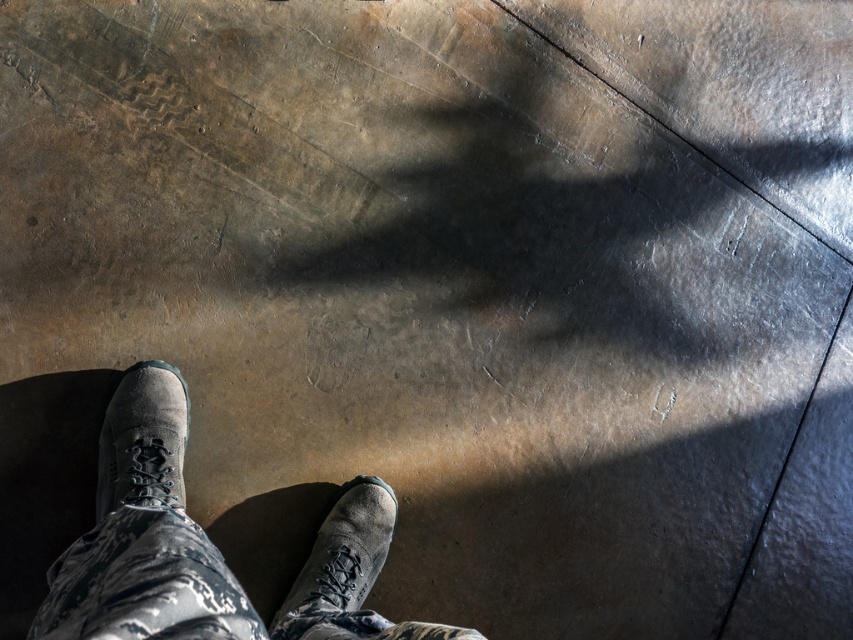
Question: From the image, what is the correct spatial relationship of camouflage pants at center in relation to gray suede boot at lower left?

Choices:
 (A) left
 (B) right

Answer: (B)

Question: Among these points, which one is nearest to the camera?

Choices:
 (A) (x=364, y=518)
 (B) (x=370, y=534)

Answer: (A)

Question: Considering the relative positions of camouflage pants at center and gray suede boot at lower left in the image provided, where is camouflage pants at center located with respect to gray suede boot at lower left?

Choices:
 (A) left
 (B) right

Answer: (B)

Question: Among these objects, which one is nearest to the camera?

Choices:
 (A) suede/black shoe at center
 (B) gray suede boot at lower left
 (C) camouflage pants at center

Answer: (C)

Question: Based on their relative distances, which object is farther from the gray suede boot at lower left?

Choices:
 (A) suede/black shoe at center
 (B) camouflage pants at center

Answer: (A)

Question: Is gray suede boot at lower left positioned at the back of suede/black shoe at center?

Choices:
 (A) no
 (B) yes

Answer: (A)